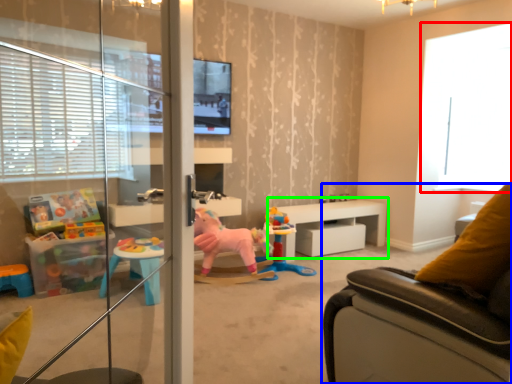
Question: Which is nearer to the window (highlighted by a red box)? studio couch (highlighted by a blue box) or table (highlighted by a green box).

Choices:
 (A) studio couch
 (B) table

Answer: (B)